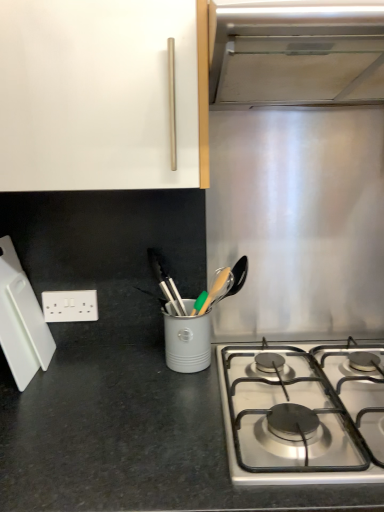
Identify the location of white glossy cabinet handle at upper center. (101, 95).

Describe the element at coordinates (70, 306) in the screenshot. The height and width of the screenshot is (512, 384). I see `white plastic electric outlet at lower left` at that location.

Measure the distance between white plastic electric outlet at lower left and camera.

white plastic electric outlet at lower left and camera are 3.89 feet apart from each other.

Find the location of `stainless steel vent at upper right`. stainless steel vent at upper right is located at coordinates (296, 52).

Can you confirm if stainless steel vent at upper right is bigger than white plastic cutting board at left?

Indeed, stainless steel vent at upper right has a larger size compared to white plastic cutting board at left.

Who is more distant, stainless steel vent at upper right or white plastic cutting board at left?

white plastic cutting board at left is further from the camera.

Is stainless steel vent at upper right facing towards white plastic cutting board at left?

No, stainless steel vent at upper right is not aimed at white plastic cutting board at left.

Which of these two, stainless steel vent at upper right or white plastic cutting board at left, stands taller?

Standing taller between the two is white plastic cutting board at left.

Is white plastic electric outlet at lower left behind white plastic cutting board at left?

Yes, it is.

Consider the image. Can you tell me how much white plastic electric outlet at lower left and white plastic cutting board at left differ in facing direction?

There is a 94.3-degree angle between the facing directions of white plastic electric outlet at lower left and white plastic cutting board at left.

Does white plastic electric outlet at lower left have a larger size compared to white plastic cutting board at left?

Incorrect, white plastic electric outlet at lower left is not larger than white plastic cutting board at left.

Can white plastic cutting board at left be found inside white plastic electric outlet at lower left?

Actually, white plastic cutting board at left is outside white plastic electric outlet at lower left.

Between white glossy cabinet handle at upper center and stainless steel gas stove at lower right, which one has larger width?

Wider between the two is stainless steel gas stove at lower right.

Is white glossy cabinet handle at upper center next to stainless steel gas stove at lower right and touching it?

No, white glossy cabinet handle at upper center is not touching stainless steel gas stove at lower right.

Considering the relative sizes of white glossy cabinet handle at upper center and stainless steel gas stove at lower right in the image provided, is white glossy cabinet handle at upper center shorter than stainless steel gas stove at lower right?

No, white glossy cabinet handle at upper center is not shorter than stainless steel gas stove at lower right.

Which object is positioned more to the left, white glossy cabinet handle at upper center or stainless steel gas stove at lower right?

From the viewer's perspective, white glossy cabinet handle at upper center appears more on the left side.

Considering the relative sizes of white plastic electric outlet at lower left and stainless steel gas stove at lower right in the image provided, is white plastic electric outlet at lower left thinner than stainless steel gas stove at lower right?

Indeed, white plastic electric outlet at lower left has a lesser width compared to stainless steel gas stove at lower right.

From a real-world perspective, is white plastic electric outlet at lower left located beneath stainless steel gas stove at lower right?

Incorrect, from a real-world perspective, white plastic electric outlet at lower left is higher than stainless steel gas stove at lower right.

Is point (45, 312) less distant than point (348, 373)?

That is False.

Between stainless steel vent at upper right and white plastic electric outlet at lower left, which one has smaller width?

white plastic electric outlet at lower left is thinner.

Which is more to the left, stainless steel vent at upper right or white plastic electric outlet at lower left?

white plastic electric outlet at lower left is more to the left.

Identify the location of vent in front of the white plastic electric outlet at lower left. (296, 52).

Does white plastic electric outlet at lower left have a larger size compared to stainless steel vent at upper right?

No, white plastic electric outlet at lower left is not bigger than stainless steel vent at upper right.

Which is in front, point (86, 298) or point (316, 84)?

Point (316, 84)

From a real-world perspective, is white plastic electric outlet at lower left positioned under stainless steel vent at upper right based on gravity?

Indeed, from a real-world perspective, white plastic electric outlet at lower left is positioned beneath stainless steel vent at upper right.

From the image's perspective, would you say white plastic electric outlet at lower left is shown under stainless steel vent at upper right?

Indeed, from the image's perspective, white plastic electric outlet at lower left is shown beneath stainless steel vent at upper right.

Does white plastic cutting board at left have a lesser width compared to stainless steel gas stove at lower right?

Correct, the width of white plastic cutting board at left is less than that of stainless steel gas stove at lower right.

From a real-world perspective, is white plastic cutting board at left below stainless steel gas stove at lower right?

Incorrect, from a real-world perspective, white plastic cutting board at left is higher than stainless steel gas stove at lower right.

Measure the distance between white plastic cutting board at left and stainless steel gas stove at lower right.

white plastic cutting board at left and stainless steel gas stove at lower right are 23.31 inches apart from each other.

Does white plastic cutting board at left have a lesser height compared to stainless steel gas stove at lower right?

No.

Identify the location of kitchen appliance located on the left of stainless steel vent at upper right. (21, 320).

Find the location of a particular element. kitchen appliance above the white plastic electric outlet at lower left (from a real-world perspective) is located at coordinates (21, 320).

Based on the photo, based on their spatial positions, is white glossy cabinet handle at upper center or white plastic cutting board at left further from stainless steel gas stove at lower right?

Based on the image, white plastic cutting board at left appears to be further to stainless steel gas stove at lower right.

Considering their positions, is white glossy cabinet handle at upper center positioned closer to stainless steel gas stove at lower right than stainless steel vent at upper right?

white glossy cabinet handle at upper center lies closer to stainless steel gas stove at lower right than the other object.

Estimate the real-world distances between objects in this image. Which object is further from white plastic electric outlet at lower left, white glossy cabinet handle at upper center or white plastic cutting board at left?

white glossy cabinet handle at upper center is further to white plastic electric outlet at lower left.

Which object lies further to the anchor point white glossy cabinet handle at upper center, stainless steel gas stove at lower right or white plastic cutting board at left?

stainless steel gas stove at lower right is positioned further to the anchor white glossy cabinet handle at upper center.

From the image, which object appears to be farther from stainless steel vent at upper right, stainless steel gas stove at lower right or white glossy cabinet handle at upper center?

stainless steel gas stove at lower right lies further to stainless steel vent at upper right than the other object.

Estimate the real-world distances between objects in this image. Which object is further from white plastic cutting board at left, white glossy cabinet handle at upper center or stainless steel gas stove at lower right?

stainless steel gas stove at lower right is positioned further to the anchor white plastic cutting board at left.

When comparing their distances from white plastic electric outlet at lower left, does white glossy cabinet handle at upper center or stainless steel vent at upper right seem closer?

Based on the image, white glossy cabinet handle at upper center appears to be nearer to white plastic electric outlet at lower left.

Based on the photo, which object lies nearer to the anchor point white plastic cutting board at left, white glossy cabinet handle at upper center or white plastic electric outlet at lower left?

Based on the image, white plastic electric outlet at lower left appears to be nearer to white plastic cutting board at left.

You are a GUI agent. You are given a task and a screenshot of the screen. Output one action in this format:
    pyautogui.click(x=<x>, y=<y>)
    Task: Click on the cabinetry between white plastic cutting board at left and stainless steel vent at upper right
    This screenshot has width=384, height=512.
    Given the screenshot: What is the action you would take?
    click(x=101, y=95)

The height and width of the screenshot is (512, 384). What are the coordinates of `kitchen appliance between white glossy cabinet handle at upper center and white plastic electric outlet at lower left vertically` in the screenshot? It's located at (21, 320).

The height and width of the screenshot is (512, 384). Find the location of `cabinetry between stainless steel vent at upper right and stainless steel gas stove at lower right in the up-down direction`. cabinetry between stainless steel vent at upper right and stainless steel gas stove at lower right in the up-down direction is located at coordinates (101, 95).

You are a GUI agent. You are given a task and a screenshot of the screen. Output one action in this format:
    pyautogui.click(x=<x>, y=<y>)
    Task: Click on the vent between white plastic cutting board at left and stainless steel gas stove at lower right
    
    Given the screenshot: What is the action you would take?
    pyautogui.click(x=296, y=52)